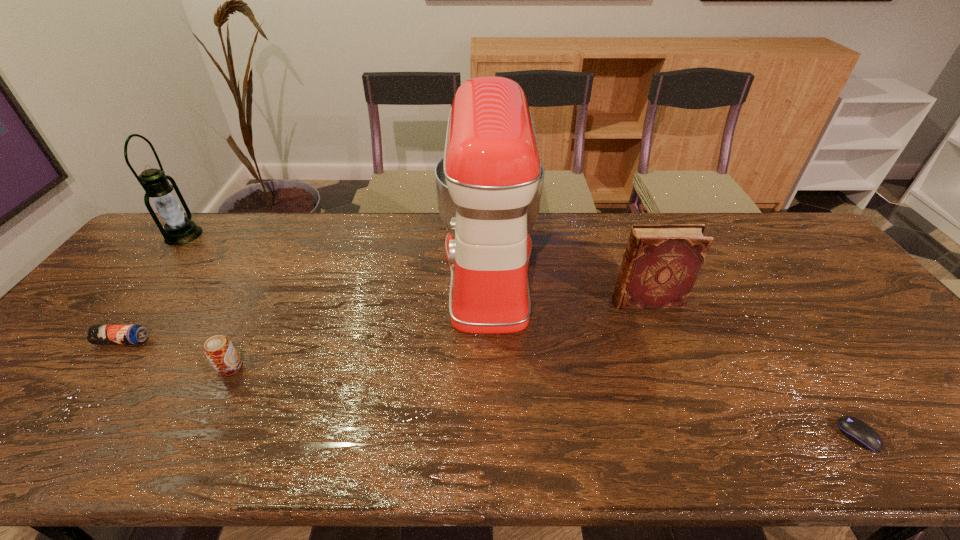
Where is `vacant space at the right edge of the desktop`? vacant space at the right edge of the desktop is located at coordinates (831, 264).

Where is `unoccupied area between the lantern and the shortest object`? This screenshot has height=540, width=960. unoccupied area between the lantern and the shortest object is located at coordinates (520, 335).

Identify the location of free point between the second nearest object and the left beer can. (177, 354).

This screenshot has width=960, height=540. What are the coordinates of `empty location between the second tallest object and the fourth shortest object` in the screenshot? It's located at (415, 268).

In order to click on unoccupied position between the right beer can and the fifth object from left to right in this screenshot , I will do `click(439, 335)`.

In order to click on free space between the fourth tallest object and the fifth shortest object in this screenshot , I will do `click(206, 301)`.

I want to click on vacant area between the rightmost object and the fifth object from left to right, so [x=753, y=368].

The image size is (960, 540). What are the coordinates of `unoccupied area between the lantern and the tallest object` in the screenshot? It's located at (336, 253).

Find the location of `unoccupied position between the computer mouse and the fourth shortest object`. unoccupied position between the computer mouse and the fourth shortest object is located at coordinates (753, 368).

At what (x,y) coordinates should I click in order to perform the action: click on free spot between the nearer beer can and the rightmost object. Please return your answer as a coordinate pair (x, y). The width and height of the screenshot is (960, 540). Looking at the image, I should click on (544, 402).